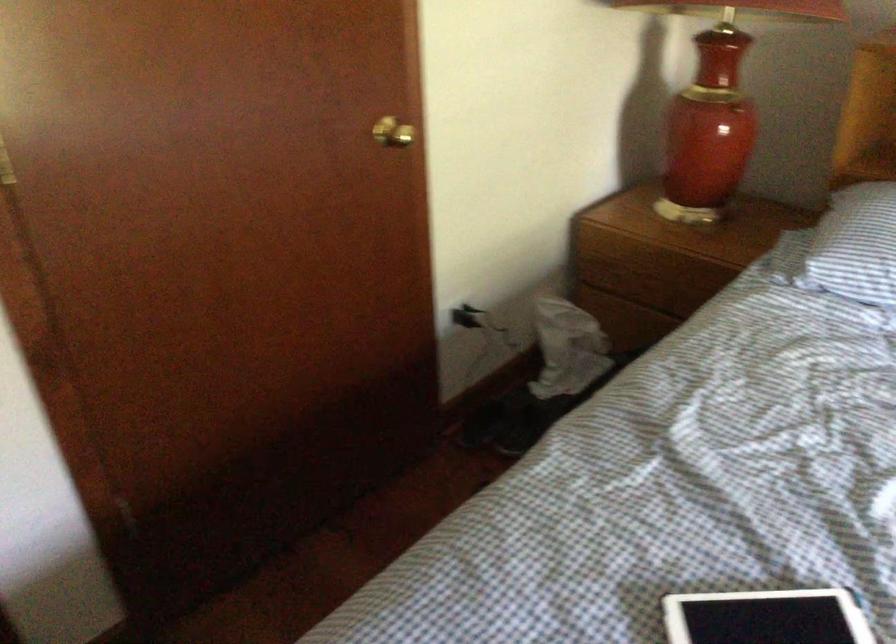
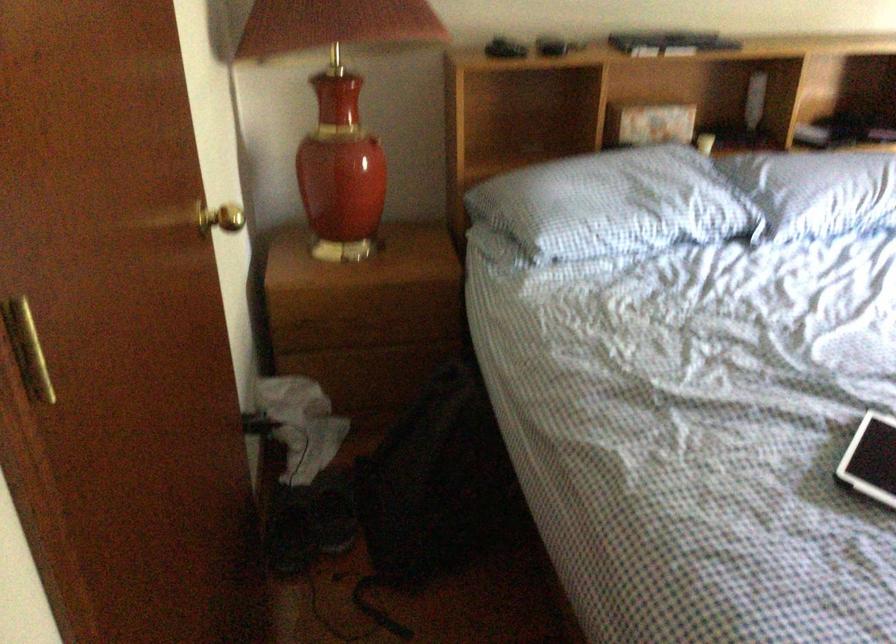
Question: I am providing you with two images of the same scene from different viewpoints. After the viewpoint changes to image2, which objects are now occluded?

Choices:
 (A) gold door knob
 (B) blue checkered pillow
 (C) brown doorstop
 (D) black power plug

Answer: (D)